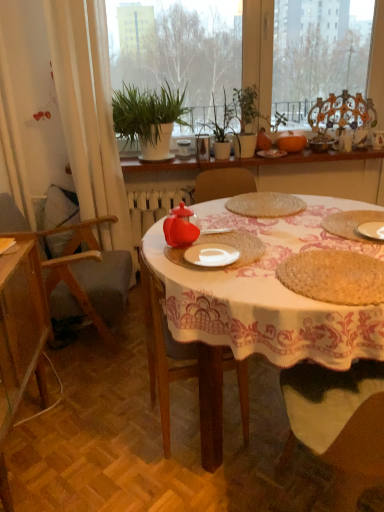
Locate an element on the screen. free point behind white ceramic plate at center is located at coordinates (233, 236).